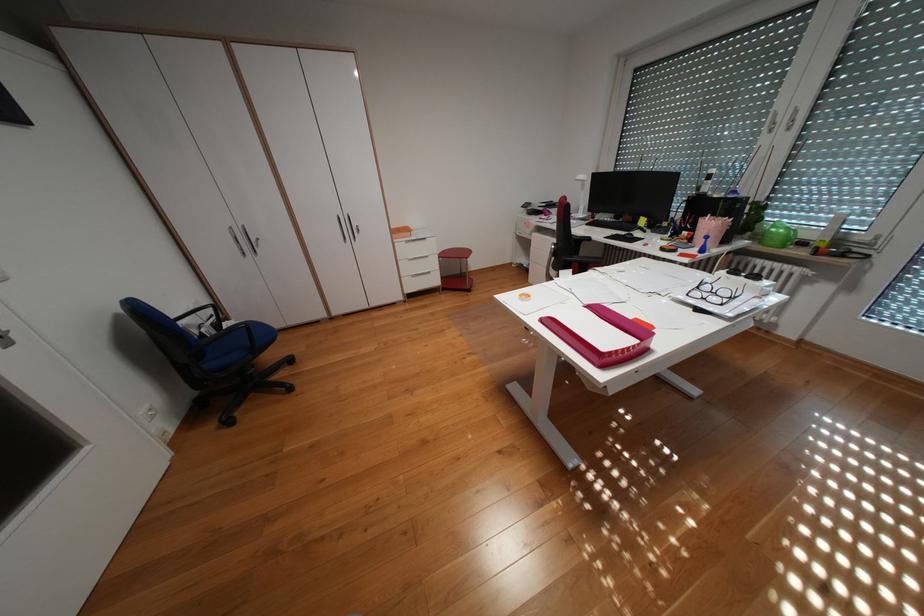
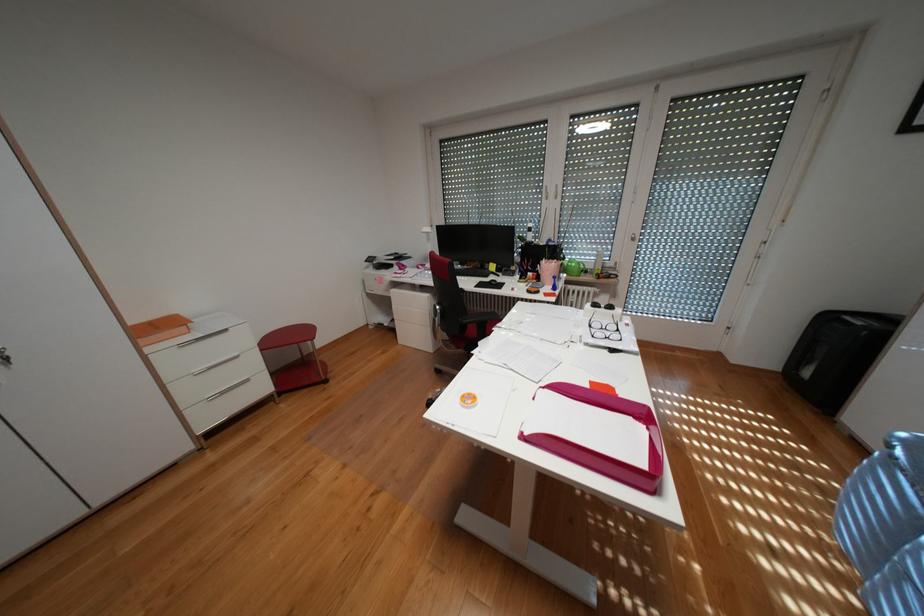
Where in the second image is the point corresponding to the point at 447,280 from the first image?

(274, 387)